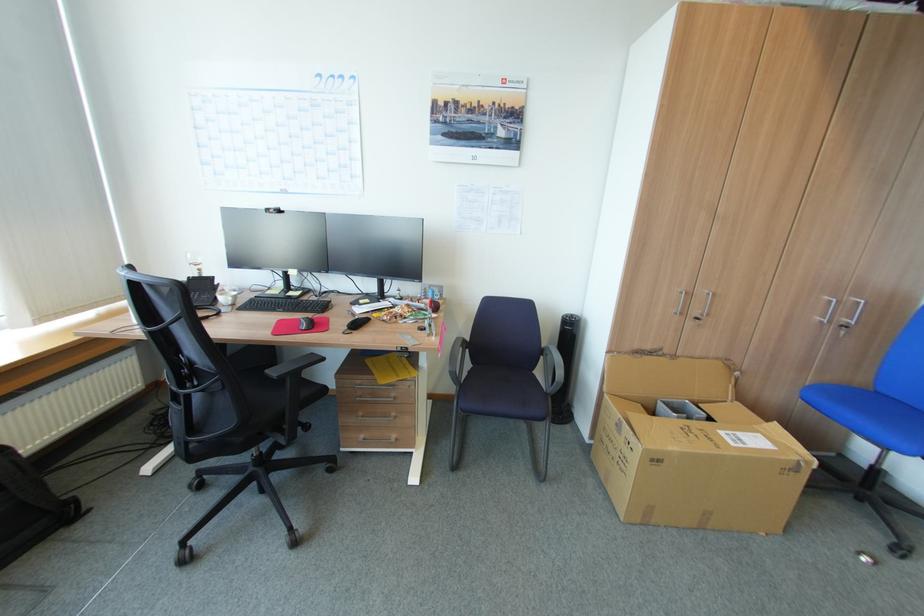
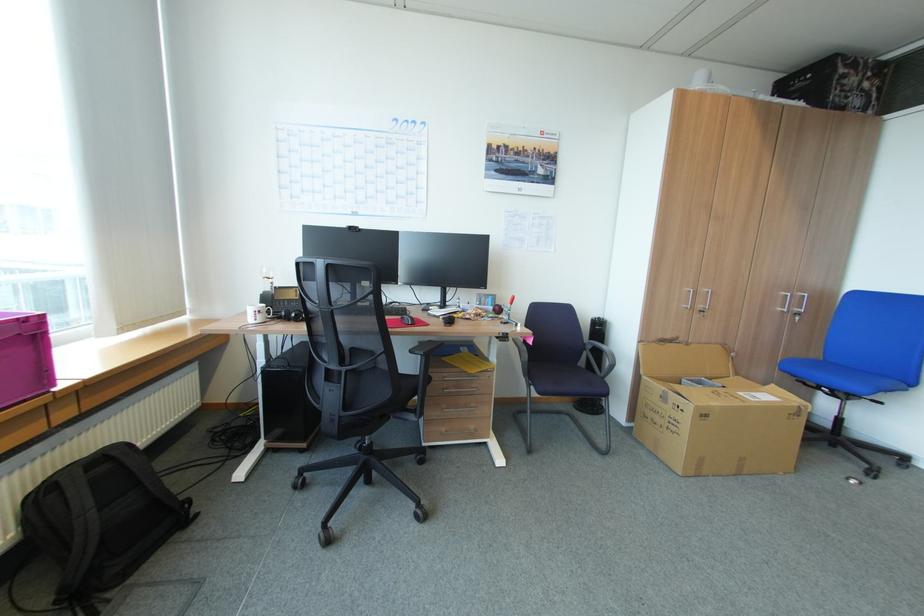
Question: The images are taken continuously from a first-person perspective. In which direction is your viewpoint rotating?

Choices:
 (A) Left
 (B) Right
 (C) Up
 (D) Down

Answer: (B)